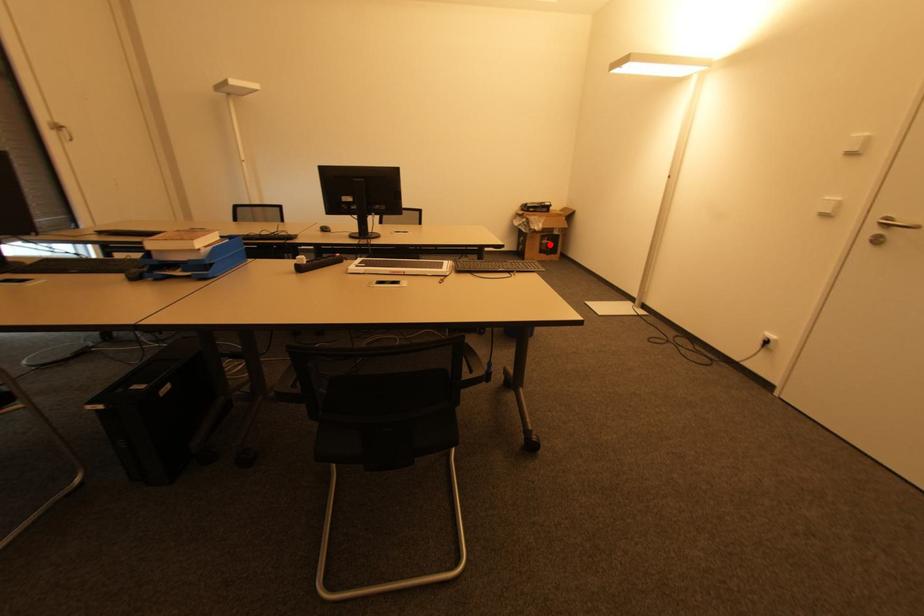
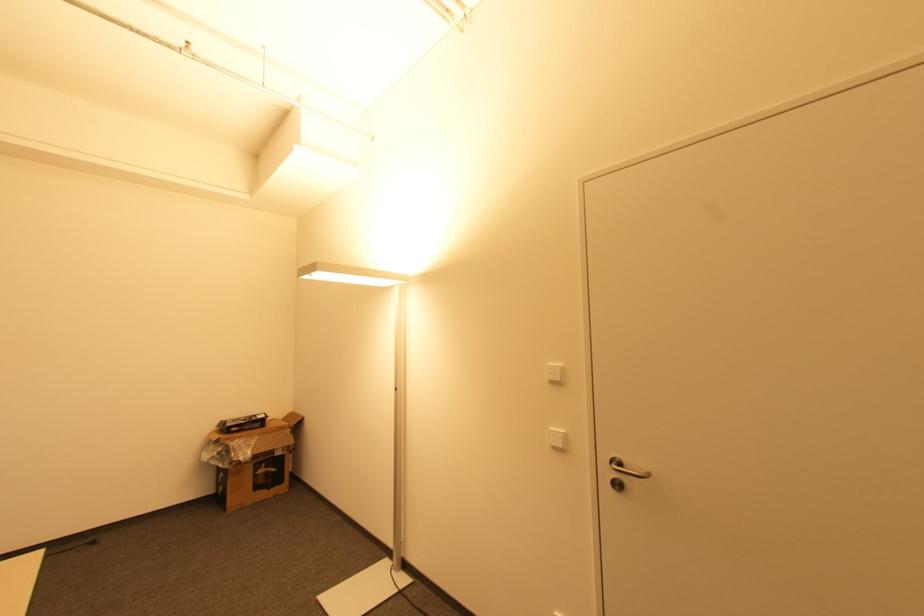
The point at the highlighted location is marked in the first image. Where is the corresponding point in the second image?

(268, 472)